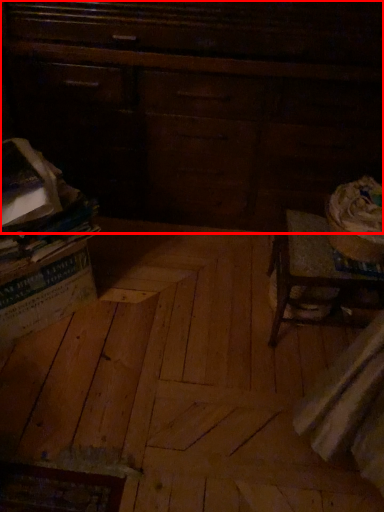
Question: From the image's perspective, where is furniture (annotated by the red box) located in relation to plywood in the image?

Choices:
 (A) below
 (B) above

Answer: (B)